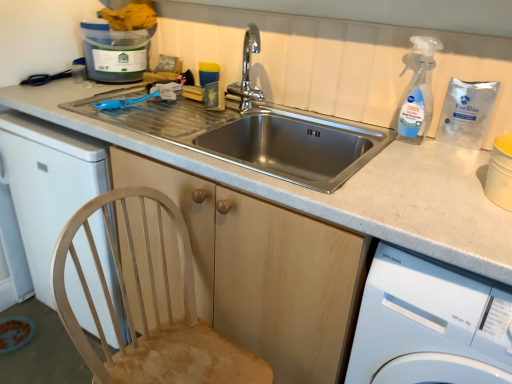
Question: From the image's perspective, is transparent plastic spray bottle at upper right above white glossy washing machine at lower right?

Choices:
 (A) yes
 (B) no

Answer: (A)

Question: Is transparent plastic spray bottle at upper right closer to camera compared to white glossy washing machine at lower right?

Choices:
 (A) no
 (B) yes

Answer: (A)

Question: Is transparent plastic spray bottle at upper right facing away from white glossy washing machine at lower right?

Choices:
 (A) no
 (B) yes

Answer: (A)

Question: Does transparent plastic spray bottle at upper right appear on the right side of white glossy washing machine at lower right?

Choices:
 (A) yes
 (B) no

Answer: (B)

Question: Could you tell me if transparent plastic spray bottle at upper right is facing white glossy washing machine at lower right?

Choices:
 (A) yes
 (B) no

Answer: (B)

Question: From the image's perspective, would you say transparent plastic spray bottle at upper right is shown under white glossy washing machine at lower right?

Choices:
 (A) yes
 (B) no

Answer: (B)

Question: Are natural wood chair at lower left and wooden cabinet at center beside each other?

Choices:
 (A) yes
 (B) no

Answer: (B)

Question: Is natural wood chair at lower left positioned far away from wooden cabinet at center?

Choices:
 (A) no
 (B) yes

Answer: (A)

Question: Can you confirm if natural wood chair at lower left is thinner than wooden cabinet at center?

Choices:
 (A) yes
 (B) no

Answer: (A)

Question: Is wooden cabinet at center surrounded by natural wood chair at lower left?

Choices:
 (A) yes
 (B) no

Answer: (B)

Question: From a real-world perspective, is natural wood chair at lower left on wooden cabinet at center?

Choices:
 (A) yes
 (B) no

Answer: (B)

Question: From a real-world perspective, is natural wood chair at lower left located beneath wooden cabinet at center?

Choices:
 (A) no
 (B) yes

Answer: (B)

Question: Is natural wood chair at lower left bigger than white glossy washing machine at lower right?

Choices:
 (A) no
 (B) yes

Answer: (A)